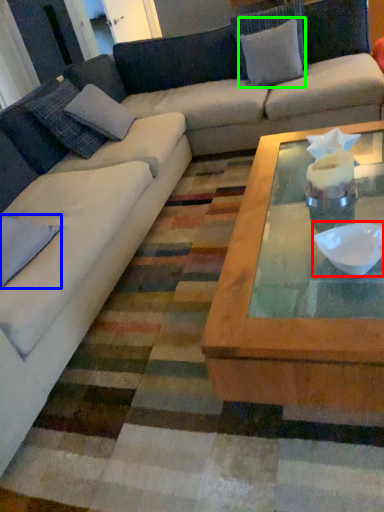
Question: Which object is the farthest from bowl (highlighted by a red box)? Choose among these: pillow (highlighted by a blue box) or pillow (highlighted by a green box).

Choices:
 (A) pillow
 (B) pillow

Answer: (B)